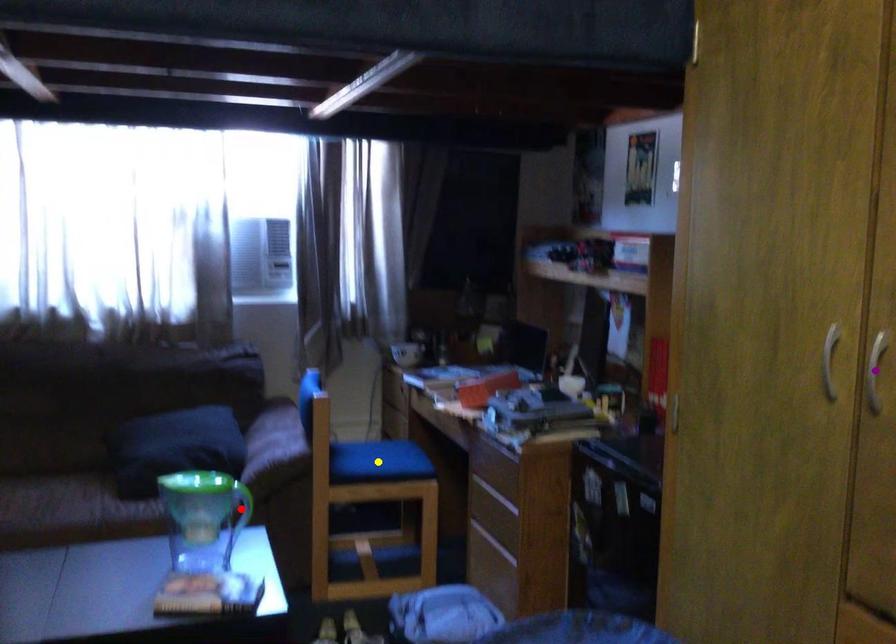
Order these from nearest to farthest:
yellow point
red point
purple point

purple point, red point, yellow point